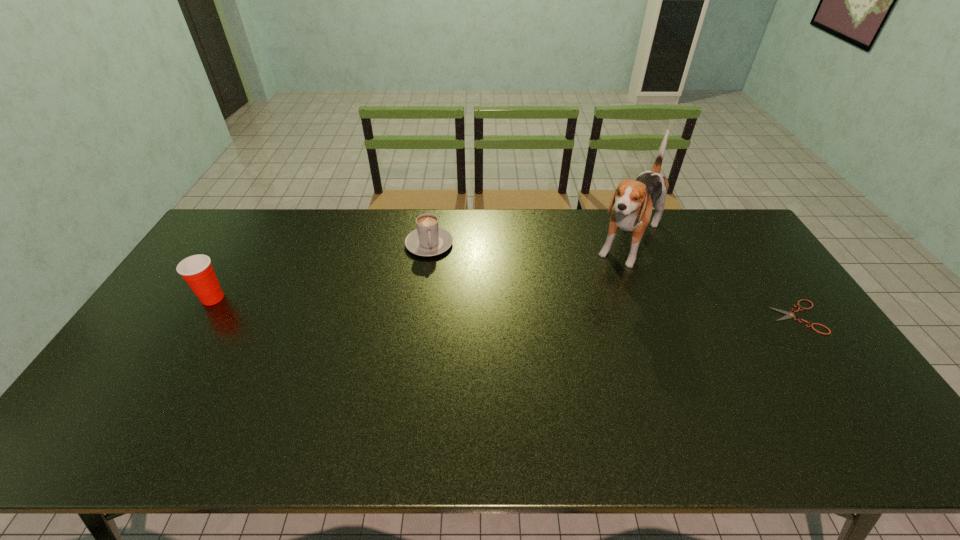
At what (x,y) coordinates should I click in order to perform the action: click on the third shortest object. Please return your answer as a coordinate pair (x, y). Looking at the image, I should click on (197, 270).

This screenshot has width=960, height=540. Identify the location of the leftmost object. [x=197, y=270].

Locate an element on the screen. The height and width of the screenshot is (540, 960). the shortest object is located at coordinates click(x=790, y=314).

Identify the location of shears. (790, 314).

Identify the location of the third object from right to left. This screenshot has width=960, height=540. (429, 239).

Find the location of a particular element. the third tallest object is located at coordinates (429, 239).

What are the coordinates of `the tallest object` in the screenshot? It's located at (634, 199).

In order to click on puppy in this screenshot , I will do [x=634, y=199].

Identify the location of vacant space located on the front of the Dixie cup. This screenshot has height=540, width=960. (164, 377).

You are a GUI agent. You are given a task and a screenshot of the screen. Output one action in this format:
    pyautogui.click(x=<x>, y=<y>)
    Task: Click on the free space located 0.050m on the back of the shears
    This screenshot has width=960, height=540.
    Given the screenshot: What is the action you would take?
    pyautogui.click(x=778, y=288)